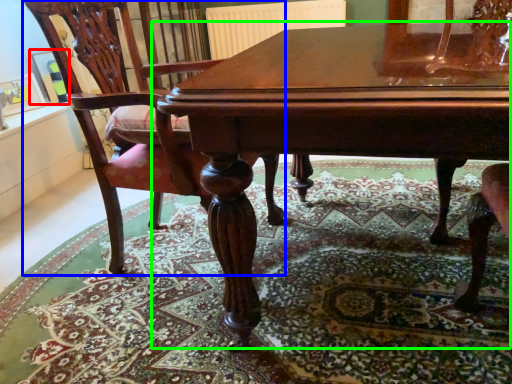
Question: Which object is positioned farthest from picture frame (highlighted by a red box)? Select from chair (highlighted by a blue box) and table (highlighted by a green box).

Choices:
 (A) chair
 (B) table

Answer: (B)